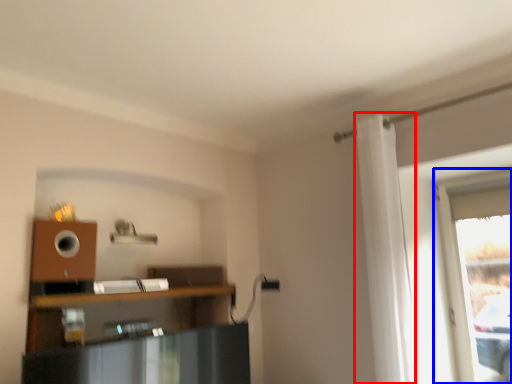
Question: Among these objects, which one is nearest to the camera, curtain (highlighted by a red box) or window (highlighted by a blue box)?

Choices:
 (A) curtain
 (B) window

Answer: (A)